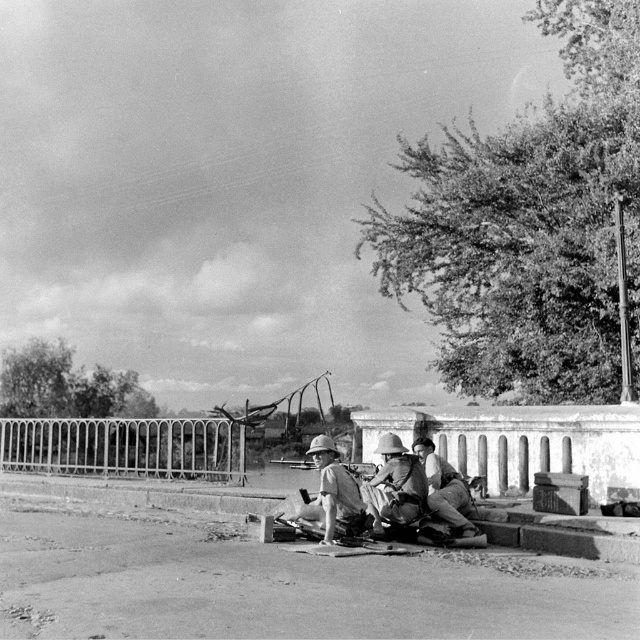
You are a soldier in the scene and need to cross from your position to the other side of the metallic wire fence at center and light brown wooden stick at center. Which object do you need to move closer to first?

You need to move closer to the metallic wire fence at center first because it is closer to you than the light brown wooden stick at center.

You are a photographer analyzing this black and white photo. You notice two points marked at coordinates point (147, 474) and point (333, 449). Which point is closer to your camera lens?

Point (147, 474) is further to the camera than point (333, 449). Therefore, point (333, 449) is closer to the camera lens.

You are a photographer analyzing this historical black and white image. You notice the metallic wire fence at center and the light brown wooden stick at center. Based on their positions in the scene, which object would cast a longer shadow given the current lighting conditions?

The light brown wooden stick at center would cast a longer shadow because it has a greater height than the metallic wire fence at center.